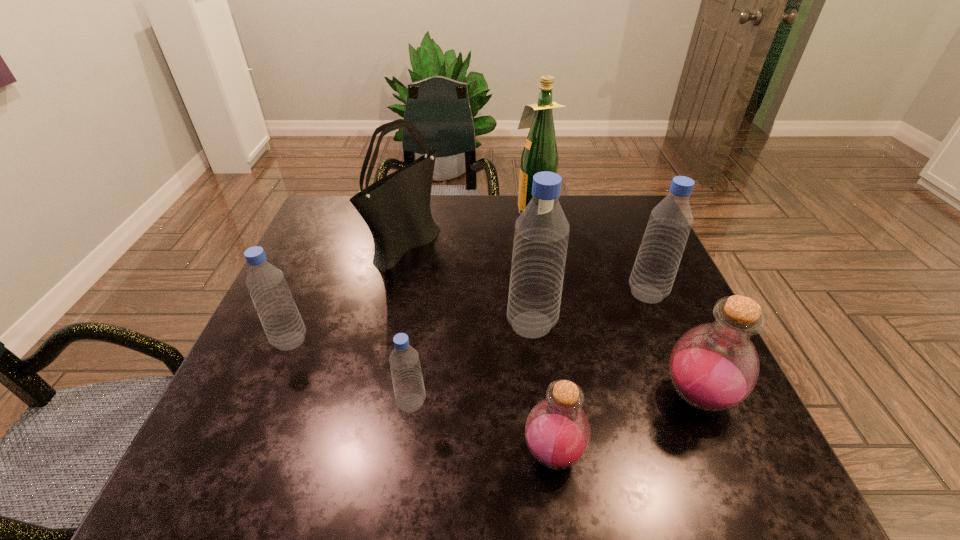
Locate an element on the screen. This screenshot has height=540, width=960. blank space located 0.360m on the back of the smallest blue bottle is located at coordinates (429, 270).

Where is `vacant region located 0.330m on the left of the left purple bottle`? This screenshot has width=960, height=540. vacant region located 0.330m on the left of the left purple bottle is located at coordinates (328, 454).

Where is `liquor at the far edge`? Image resolution: width=960 pixels, height=540 pixels. liquor at the far edge is located at coordinates (540, 153).

Locate an element on the screen. shoulder bag that is at the far edge is located at coordinates (396, 208).

The height and width of the screenshot is (540, 960). Identify the location of object located in the near edge section of the desktop. (557, 431).

The height and width of the screenshot is (540, 960). Find the location of `object positioned at the left edge`. object positioned at the left edge is located at coordinates (278, 313).

The height and width of the screenshot is (540, 960). I want to click on free location at the far edge, so click(x=491, y=195).

In order to click on vacant area at the near edge in this screenshot , I will do `click(623, 444)`.

The width and height of the screenshot is (960, 540). What are the coordinates of `vacant space at the left edge of the desktop` in the screenshot? It's located at (263, 420).

At what (x,y) coordinates should I click in order to perform the action: click on free region at the far left corner of the desktop. Please return your answer as a coordinate pair (x, y). Image resolution: width=960 pixels, height=540 pixels. Looking at the image, I should click on (310, 227).